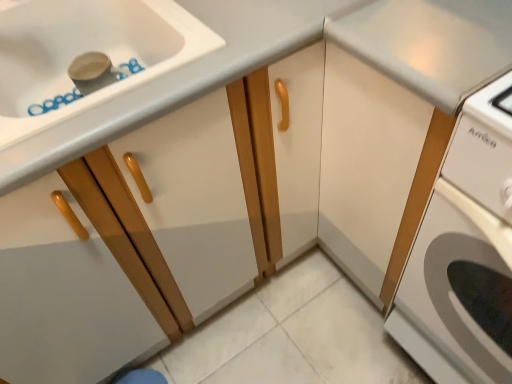
Question: Should I look upward or downward to see matte wood cabinet at left, the 1th cabinetry from the left?

Choices:
 (A) up
 (B) down

Answer: (A)

Question: Which direction should I rotate to look at white matte cabinet at center, the 2th cabinetry positioned from the left, — up or down?

Choices:
 (A) down
 (B) up

Answer: (B)

Question: From the image's perspective, does white matte cabinet at center, the 2th cabinetry positioned from the left, appear lower than white glossy washing machine at right?

Choices:
 (A) yes
 (B) no

Answer: (B)

Question: Does white matte cabinet at center, placed as the 1th cabinetry when sorted from right to left, turn towards white glossy washing machine at right?

Choices:
 (A) no
 (B) yes

Answer: (A)

Question: From a real-world perspective, is white matte cabinet at center, the 2th cabinetry positioned from the left, located beneath white glossy washing machine at right?

Choices:
 (A) yes
 (B) no

Answer: (B)

Question: Can you confirm if white matte cabinet at center, the 2th cabinetry positioned from the left, is thinner than white glossy washing machine at right?

Choices:
 (A) no
 (B) yes

Answer: (B)

Question: Is the depth of white matte cabinet at center, the 2th cabinetry positioned from the left, less than that of white glossy washing machine at right?

Choices:
 (A) yes
 (B) no

Answer: (B)

Question: Is white matte cabinet at center, the 2th cabinetry positioned from the left, not inside white glossy washing machine at right?

Choices:
 (A) no
 (B) yes

Answer: (B)

Question: Is white glossy washing machine at right turned away from white matte cabinet at center, placed as the 1th cabinetry when sorted from right to left?

Choices:
 (A) no
 (B) yes

Answer: (A)

Question: Does white glossy washing machine at right have a smaller size compared to white matte cabinet at center, the 2th cabinetry positioned from the left?

Choices:
 (A) yes
 (B) no

Answer: (A)

Question: Can you confirm if white glossy washing machine at right is taller than white matte cabinet at center, placed as the 1th cabinetry when sorted from right to left?

Choices:
 (A) no
 (B) yes

Answer: (A)

Question: Considering the relative sizes of white glossy washing machine at right and white matte cabinet at center, placed as the 1th cabinetry when sorted from right to left, in the image provided, is white glossy washing machine at right wider than white matte cabinet at center, placed as the 1th cabinetry when sorted from right to left,?

Choices:
 (A) no
 (B) yes

Answer: (B)

Question: From a real-world perspective, is white glossy washing machine at right located higher than white matte cabinet at center, the 2th cabinetry positioned from the left?

Choices:
 (A) yes
 (B) no

Answer: (B)

Question: From the image's perspective, would you say white glossy washing machine at right is positioned over white matte cabinet at center, placed as the 1th cabinetry when sorted from right to left?

Choices:
 (A) yes
 (B) no

Answer: (B)

Question: Considering the relative sizes of matte wood cabinet at left, the 1th cabinetry from the left, and white matte cabinet at center, the 2th cabinetry positioned from the left, in the image provided, is matte wood cabinet at left, the 1th cabinetry from the left, taller than white matte cabinet at center, the 2th cabinetry positioned from the left,?

Choices:
 (A) yes
 (B) no

Answer: (B)